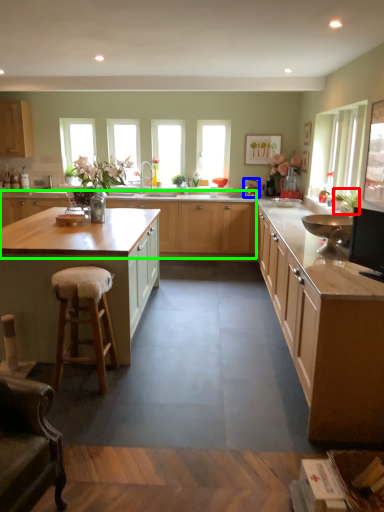
Question: Considering the real-world distances, which object is farthest from plant (highlighted by a red box)? appliance (highlighted by a blue box) or cabinetry (highlighted by a green box)?

Choices:
 (A) appliance
 (B) cabinetry

Answer: (A)